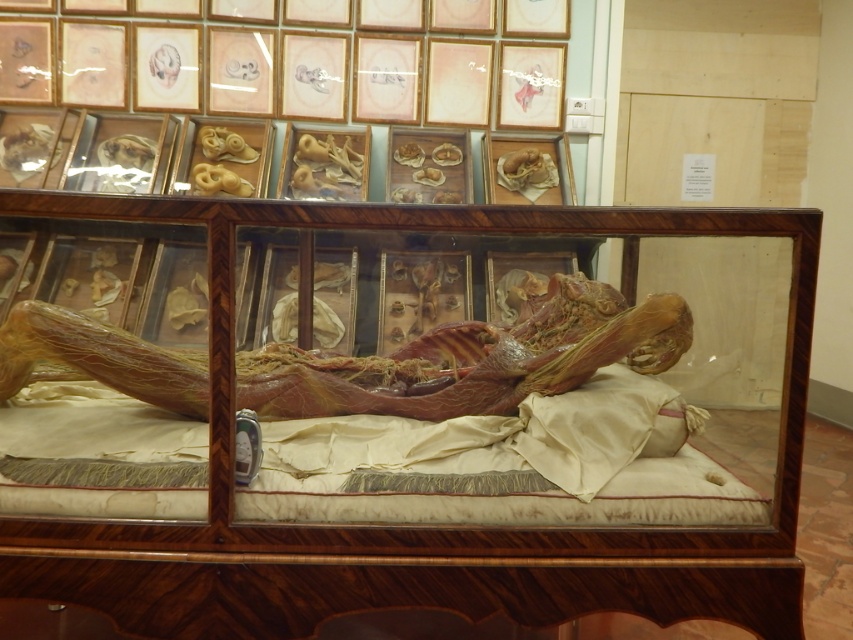
Question: Does transparent wood glass box at center appear on the left side of translucent flesh at center?

Choices:
 (A) yes
 (B) no

Answer: (B)

Question: Among these objects, which one is nearest to the camera?

Choices:
 (A) translucent flesh at center
 (B) transparent wood glass box at center

Answer: (B)

Question: Considering the relative positions of transparent wood glass box at center and translucent flesh at center in the image provided, where is transparent wood glass box at center located with respect to translucent flesh at center?

Choices:
 (A) below
 (B) above

Answer: (B)

Question: Can you confirm if transparent wood glass box at center is positioned below translucent flesh at center?

Choices:
 (A) yes
 (B) no

Answer: (B)

Question: Which point is closer to the camera?

Choices:
 (A) transparent wood glass box at center
 (B) translucent flesh at center

Answer: (A)